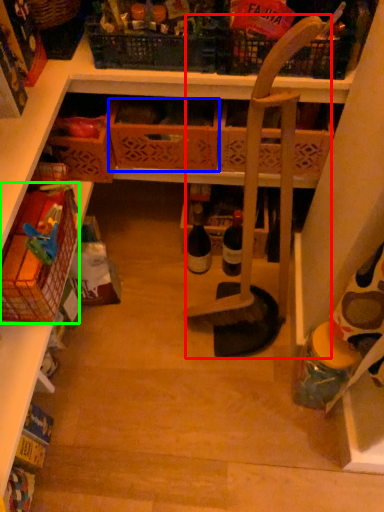
Question: Estimate the real-world distances between objects in this image. Which object is farther from chair (highlighted by a red box), basket (highlighted by a blue box) or basket (highlighted by a green box)?

Choices:
 (A) basket
 (B) basket

Answer: (B)